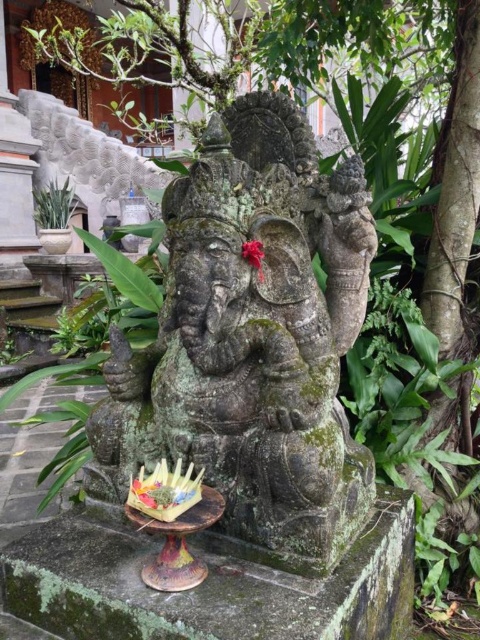
Does green mossy stone statue at center have a greater height compared to green leafy plant at left?

Yes.

Which is in front, point (311, 340) or point (55, 202)?

Point (311, 340) is in front.

Consider the image. Who is more forward, (297, 164) or (38, 218)?

Point (297, 164) is in front.

Find the location of a particular element. The image size is (480, 640). green mossy stone statue at center is located at coordinates (252, 340).